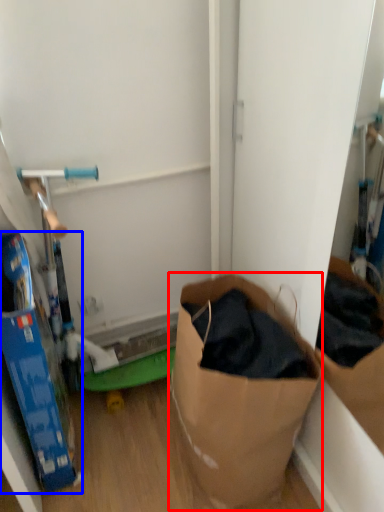
Question: Which object appears closest to the camera in this image, paper bag (highlighted by a red box) or box (highlighted by a blue box)?

Choices:
 (A) paper bag
 (B) box

Answer: (B)